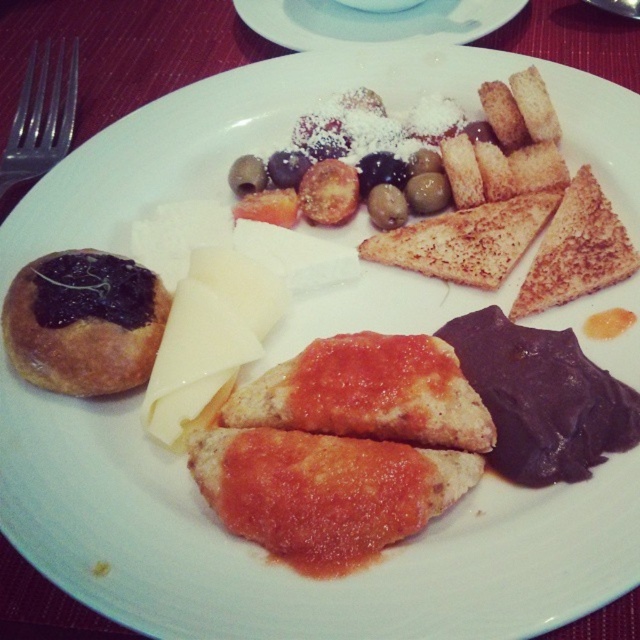
This screenshot has width=640, height=640. Describe the element at coordinates (209, 339) in the screenshot. I see `white creamy cheese at center` at that location.

The image size is (640, 640). What are the coordinates of `white creamy cheese at center` in the screenshot? It's located at (209, 339).

This screenshot has height=640, width=640. Identify the location of white creamy cheese at center. (209, 339).

Between golden brown doughnut at left and white ceramic plate at center, which one appears on the right side from the viewer's perspective?

white ceramic plate at center is more to the right.

You are a GUI agent. You are given a task and a screenshot of the screen. Output one action in this format:
    pyautogui.click(x=<x>, y=<y>)
    Task: Click on the golden brown doughnut at left
    Image resolution: width=640 pixels, height=640 pixels.
    Given the screenshot: What is the action you would take?
    pyautogui.click(x=83, y=323)

Is point (113, 276) less distant than point (355, 38)?

Yes, point (113, 276) is closer to viewer.

This screenshot has width=640, height=640. In order to click on golden brown doughnut at left in this screenshot , I will do `click(83, 323)`.

Is point (118, 296) positioned in front of point (540, 244)?

Yes, point (118, 296) is closer to viewer.

The image size is (640, 640). Find the location of `golden brown doughnut at left`. golden brown doughnut at left is located at coordinates (83, 323).